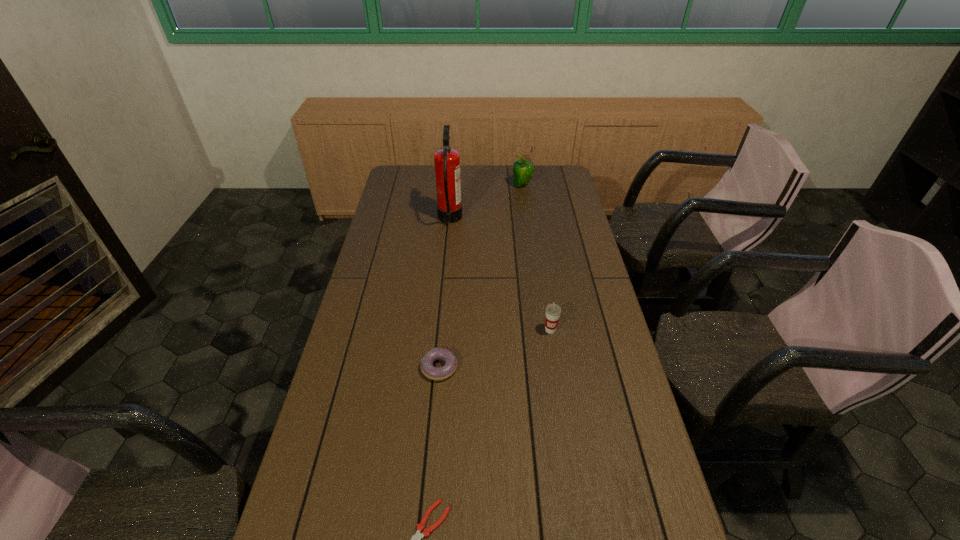
In order to click on free space located on the side of the cup with the logo in this screenshot , I will do `click(567, 436)`.

This screenshot has height=540, width=960. I want to click on vacant space positioned on the left of the doughnut, so click(360, 368).

Locate an element on the screen. object that is positioned at the far edge is located at coordinates (523, 170).

Image resolution: width=960 pixels, height=540 pixels. Identify the location of vacant point at the far edge. (500, 175).

What are the coordinates of `vacant space at the left edge of the desktop` in the screenshot? It's located at (406, 240).

In the image, there is a desktop. What are the coordinates of `free space at the right edge` in the screenshot? It's located at (594, 396).

Identify the location of vacant space at the far left corner. This screenshot has width=960, height=540. (396, 175).

The height and width of the screenshot is (540, 960). In order to click on vacant space at the far right corner of the desktop in this screenshot , I will do `click(537, 181)`.

At what (x,y) coordinates should I click in order to perform the action: click on empty space that is in between the third nearest object and the second farthest object. Please return your answer as a coordinate pair (x, y). Image resolution: width=960 pixels, height=540 pixels. Looking at the image, I should click on (500, 275).

I want to click on vacant area that lies between the fourth farthest object and the cup, so click(494, 349).